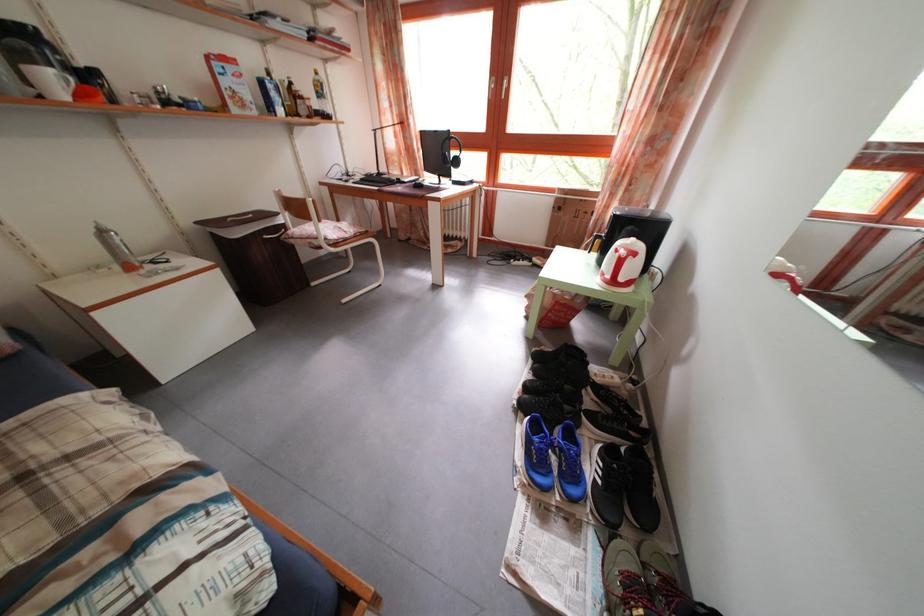
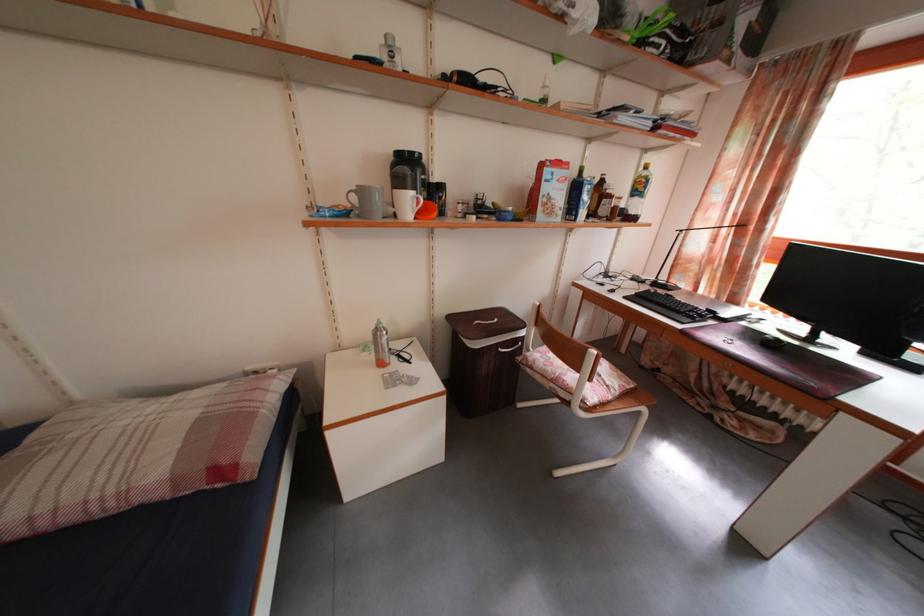
Where in the second image is the point corresponding to point 108,238 from the first image?

(384, 338)